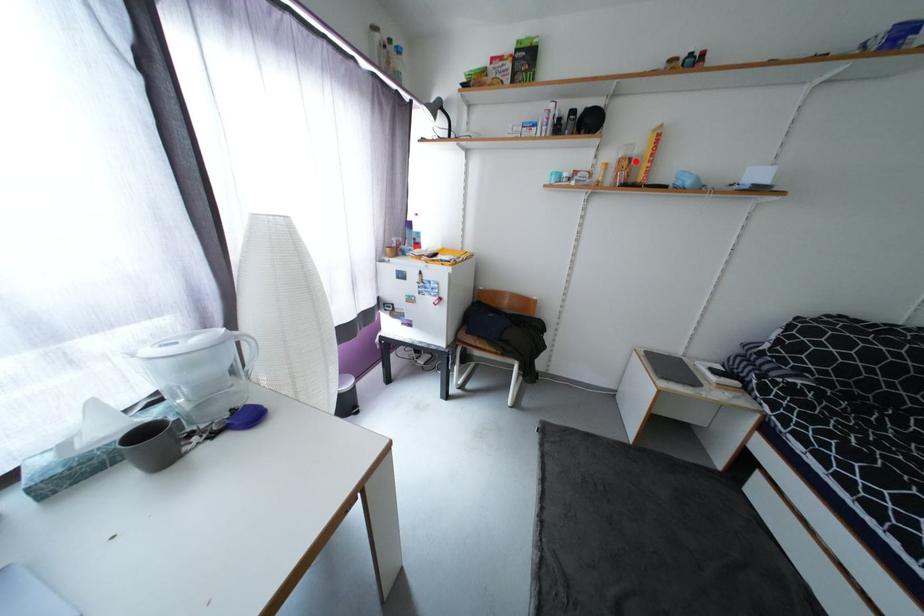
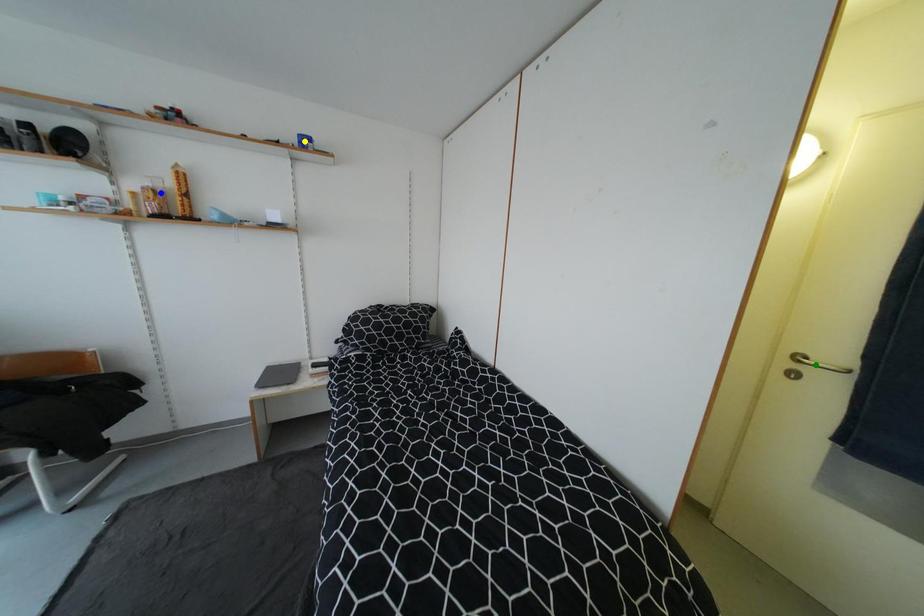
Question: I am providing you with two images of the same scene from different viewpoints. A red point is marked on the first image. You are given multiple points on the second image. Which point in image 2 is actually the same real-world point as the red point in image 1?

Choices:
 (A) green point
 (B) yellow point
 (C) blue point

Answer: (C)